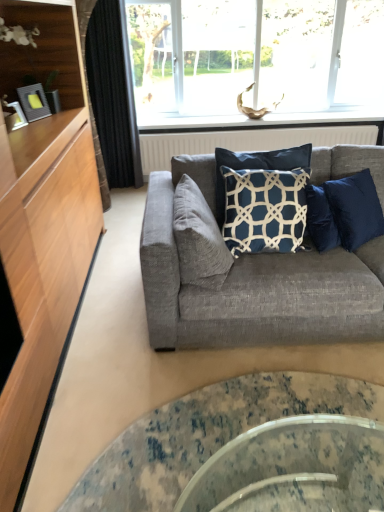
Question: From the image's perspective, relative to suede gray pillow at center, placed as the second pillow when sorted from right to left, is white textured radiator at upper center above or below?

Choices:
 (A) above
 (B) below

Answer: (A)

Question: From a real-world perspective, relative to suede gray pillow at center, placed as the second pillow when sorted from right to left, is white textured radiator at upper center vertically above or below?

Choices:
 (A) below
 (B) above

Answer: (A)

Question: Which object is the closest to the navy blue fabric pillow at center, which appears as the second pillow when viewed from the left?

Choices:
 (A) textured gray couch at center
 (B) white textured radiator at upper center
 (C) transparent glass window at upper center
 (D) black fabric curtain at left
 (E) clear glass coffee table at center

Answer: (A)

Question: Which object is positioned farthest from the transparent glass window at upper center?

Choices:
 (A) navy blue fabric pillow at center, which appears as the second pillow when viewed from the left
 (B) clear glass coffee table at center
 (C) suede gray pillow at center, the 1th pillow in the left-to-right sequence
 (D) black fabric curtain at left
 (E) white textured radiator at upper center

Answer: (B)